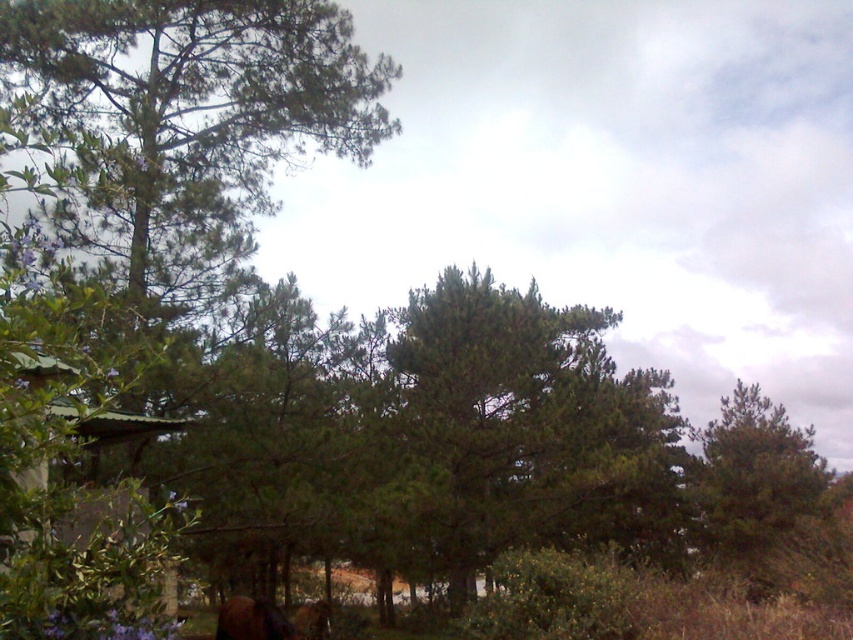
You are standing in the natural outdoor scene with dense coniferous trees and want to find shelter from the rain. The green corrugated metal hut at lower left is your only option. Based on its position, can you estimate whether it is closer to the edge of the scene or near the center?

The green corrugated metal hut at lower left is located at point (109, 531), which places it closer to the edge of the scene rather than the center. The coordinates suggest it is positioned near the lower left corner, making it closer to the edge.

You are a delivery robot with a maximum range of 15 meters. You need to deliver a package to the green corrugated metal hut at lower left from your current position near the brown furry dog at lower center. Can you reach the hut without exceeding your range?

The distance between the green corrugated metal hut at lower left and the brown furry dog at lower center is 14.71 meters, which is within your 15 meters range. Therefore, you can deliver the package to the green corrugated metal hut at lower left without exceeding your range.